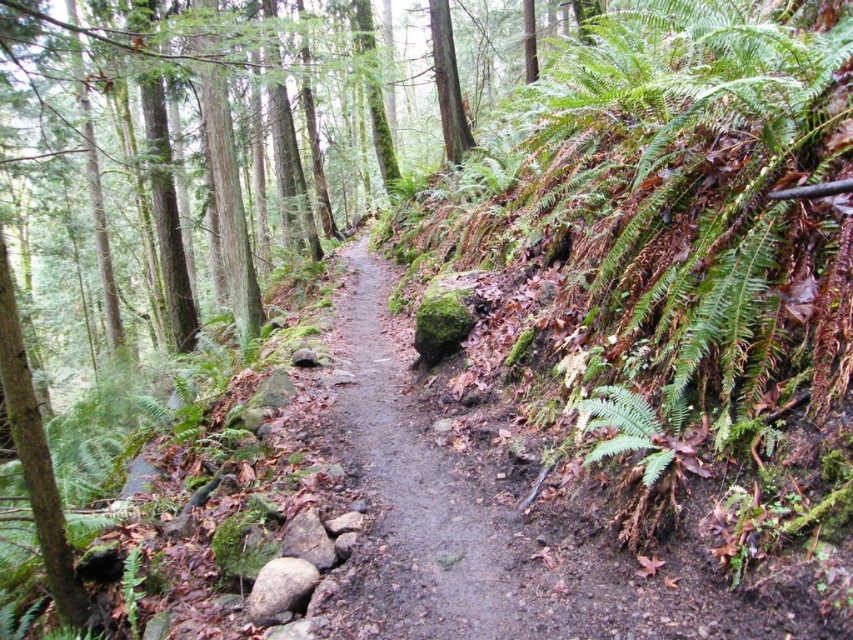
Question: Can you confirm if dirt path at center is smaller than green leafy fern at lower right?

Choices:
 (A) no
 (B) yes

Answer: (A)

Question: Can you confirm if dirt path at center is wider than green leafy fern at lower right?

Choices:
 (A) yes
 (B) no

Answer: (A)

Question: Is dirt path at center smaller than green leafy fern at lower right?

Choices:
 (A) yes
 (B) no

Answer: (B)